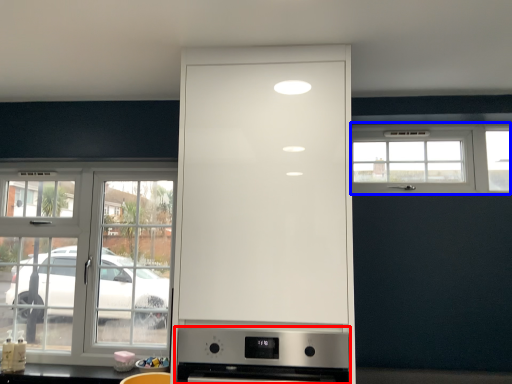
Question: Which object is further to the camera taking this photo, home appliance (highlighted by a red box) or window (highlighted by a blue box)?

Choices:
 (A) home appliance
 (B) window

Answer: (B)